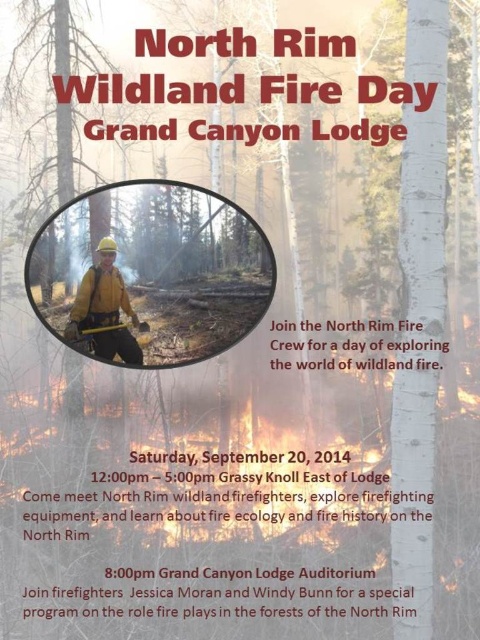
Question: Is smooth bark tree at center thinner than matte yellow helmet at center?

Choices:
 (A) yes
 (B) no

Answer: (B)

Question: Can you confirm if smooth bark tree at center is positioned to the right of matte yellow helmet at center?

Choices:
 (A) no
 (B) yes

Answer: (A)

Question: Which object appears farthest from the camera in this image?

Choices:
 (A) matte yellow helmet at center
 (B) smooth bark tree at center

Answer: (A)

Question: Does smooth bark tree at center appear on the right side of matte yellow helmet at center?

Choices:
 (A) no
 (B) yes

Answer: (A)

Question: Among these objects, which one is nearest to the camera?

Choices:
 (A) smooth bark tree at center
 (B) matte yellow helmet at center

Answer: (A)

Question: Which point is farther to the camera?

Choices:
 (A) smooth bark tree at center
 (B) matte yellow helmet at center

Answer: (B)